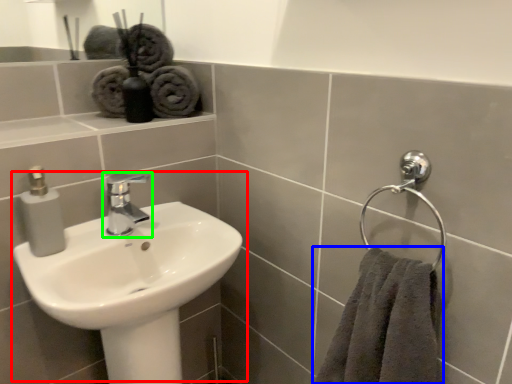
Question: Considering the real-world distances, which object is farthest from sink (highlighted by a red box)? towel (highlighted by a blue box) or tap (highlighted by a green box)?

Choices:
 (A) towel
 (B) tap

Answer: (A)